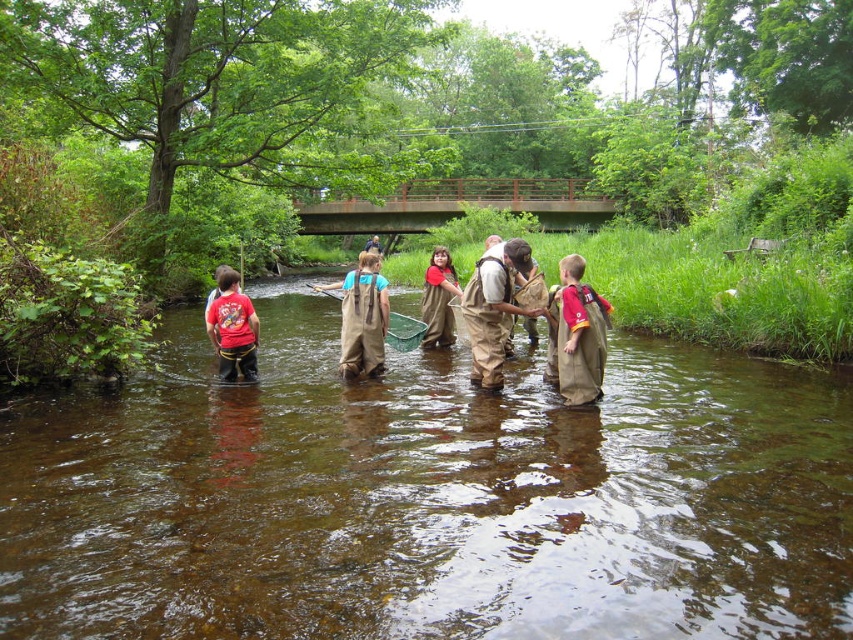
You are a nature guide leading a group near a stream. You need to retrieve a sample from the water using a net. The brown waterproof boots at center and brown canvas waders at center are part of your equipment. Can you reach the net placed between them without stepping into the water?

The distance between the brown waterproof boots at center and brown canvas waders at center is 1.82 meters. Since the net is placed between them, you can reach it without stepping into the water as the distance is manageable.

You are standing at the point labeled as point (233, 330) and want to move to the point labeled as point (587, 308). Which direction should you move to reach your destination?

You should move towards the direction away from the viewer since point (587, 308) is closer to the viewer than point (233, 330).